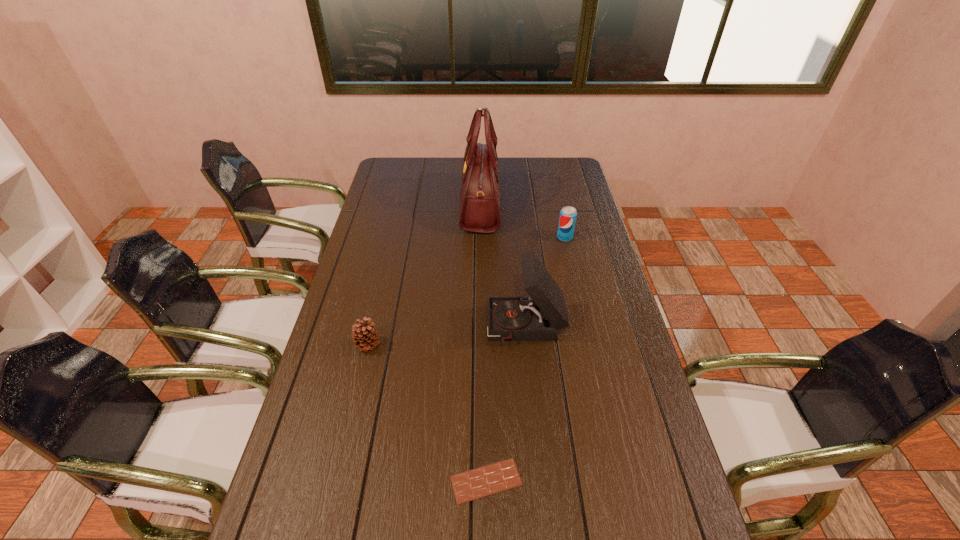
Locate an element on the screen. The image size is (960, 540). the tallest object is located at coordinates (480, 194).

This screenshot has height=540, width=960. What are the coordinates of `phonograph_record` in the screenshot? It's located at (539, 317).

Locate an element on the screen. This screenshot has width=960, height=540. the rightmost object is located at coordinates (568, 214).

Image resolution: width=960 pixels, height=540 pixels. Identify the location of the leftmost object. (364, 336).

Image resolution: width=960 pixels, height=540 pixels. In order to click on the nearest object in this screenshot , I will do `click(470, 485)`.

You are a GUI agent. You are given a task and a screenshot of the screen. Output one action in this format:
    pyautogui.click(x=<x>, y=<y>)
    Task: Click on the shortest object
    This screenshot has width=960, height=540.
    Given the screenshot: What is the action you would take?
    pyautogui.click(x=470, y=485)

You are a GUI agent. You are given a task and a screenshot of the screen. Output one action in this format:
    pyautogui.click(x=<x>, y=<y>)
    Task: Click on the free spot located 0.310m on the front-facing side of the tallest object
    Image resolution: width=960 pixels, height=540 pixels.
    Given the screenshot: What is the action you would take?
    pyautogui.click(x=389, y=204)

You are a GUI agent. You are given a task and a screenshot of the screen. Output one action in this format:
    pyautogui.click(x=<x>, y=<y>)
    Task: Click on the vacant region located on the front-facing side of the tallest object
    
    Given the screenshot: What is the action you would take?
    pyautogui.click(x=405, y=204)

Identify the location of vacant space located 0.220m on the front-facing side of the tallest object. (410, 204).

At what (x,y) coordinates should I click in order to perform the action: click on blank area located 0.270m on the front-facing side of the fourth shortest object. Please return your answer as a coordinate pair (x, y). Looking at the image, I should click on (401, 328).